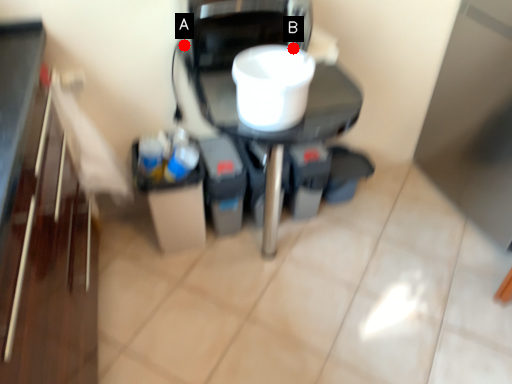
Question: Two points are circled on the image, labeled by A and B beside each circle. Which point is farther from the camera taking this photo?

Choices:
 (A) A is further
 (B) B is further

Answer: (A)